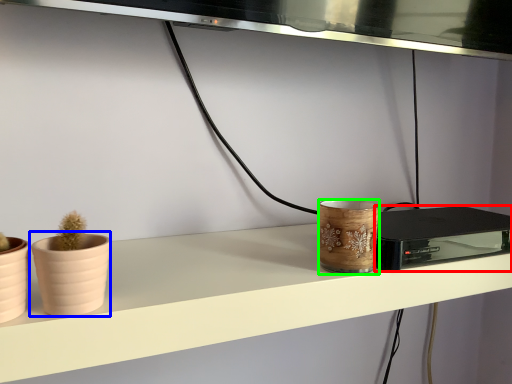
Question: Based on their relative distances, which object is farther from appliance (highlighted by a red box)? Choose from flowerpot (highlighted by a blue box) and pottery (highlighted by a green box).

Choices:
 (A) flowerpot
 (B) pottery

Answer: (A)